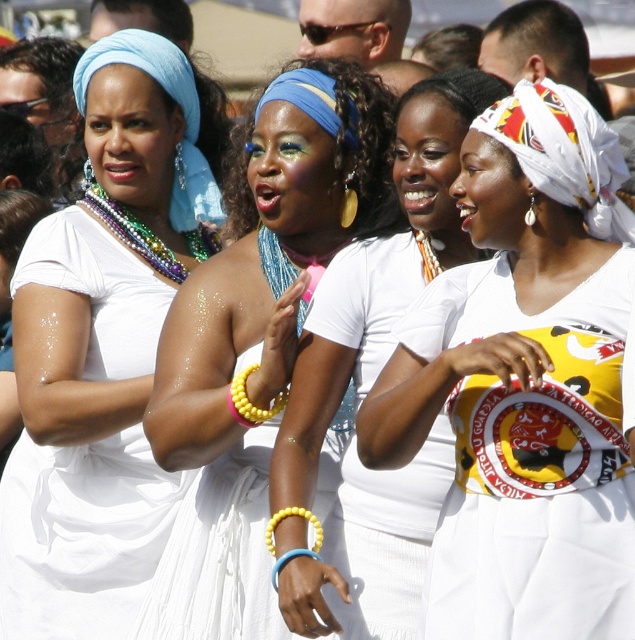
You are a photographer trying to capture a closeup of the yellow beaded bracelet at center and the yellow rubber bracelet at center. Which bracelet is closer to you, the photographer?

The yellow beaded bracelet at center is closer to you than the yellow rubber bracelet at center.